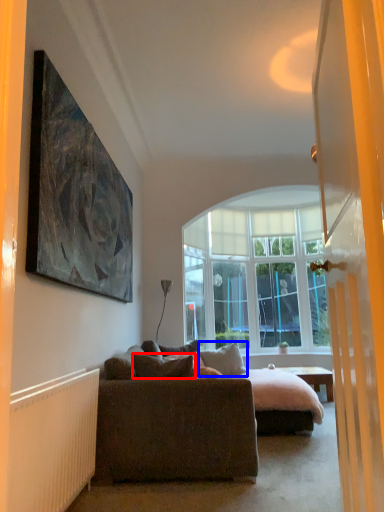
Question: Among these objects, which one is nearest to the camera, pillow (highlighted by a red box) or pillow (highlighted by a blue box)?

Choices:
 (A) pillow
 (B) pillow

Answer: (A)